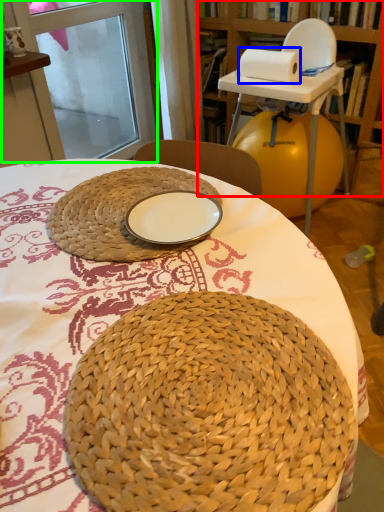
Question: Which object is positioned closest to bookshelf (highlighted by a red box)? Select from paper towel (highlighted by a blue box) and screen door (highlighted by a green box).

Choices:
 (A) paper towel
 (B) screen door

Answer: (A)